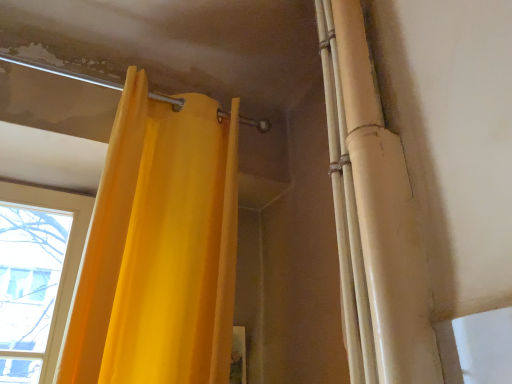
Question: In terms of width, does matte yellow curtain at upper left look wider or thinner when compared to matte yellow curtain at upper right?

Choices:
 (A) thin
 (B) wide

Answer: (B)

Question: Is point (175, 185) positioned closer to the camera than point (355, 228)?

Choices:
 (A) farther
 (B) closer

Answer: (A)

Question: Relative to matte yellow curtain at upper right, is matte yellow curtain at upper left in front or behind?

Choices:
 (A) behind
 (B) front

Answer: (A)

Question: Is matte yellow curtain at upper right taller or shorter than matte yellow curtain at upper left?

Choices:
 (A) short
 (B) tall

Answer: (B)

Question: Is matte yellow curtain at upper right wider or thinner than matte yellow curtain at upper left?

Choices:
 (A) thin
 (B) wide

Answer: (A)

Question: Considering the relative positions of matte yellow curtain at upper right and matte yellow curtain at upper left in the image provided, is matte yellow curtain at upper right to the left or to the right of matte yellow curtain at upper left?

Choices:
 (A) left
 (B) right

Answer: (B)

Question: From a real-world perspective, relative to matte yellow curtain at upper left, is matte yellow curtain at upper right vertically above or below?

Choices:
 (A) below
 (B) above

Answer: (B)